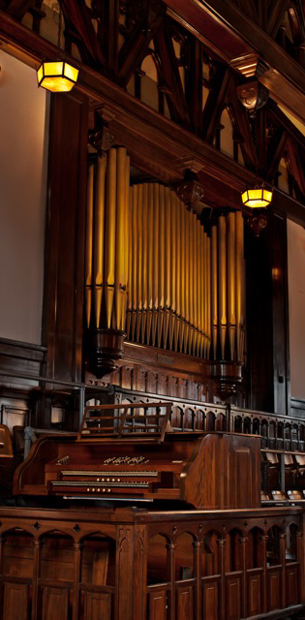
Locate an element on the screen. stand is located at coordinates (164, 420), (82, 423).